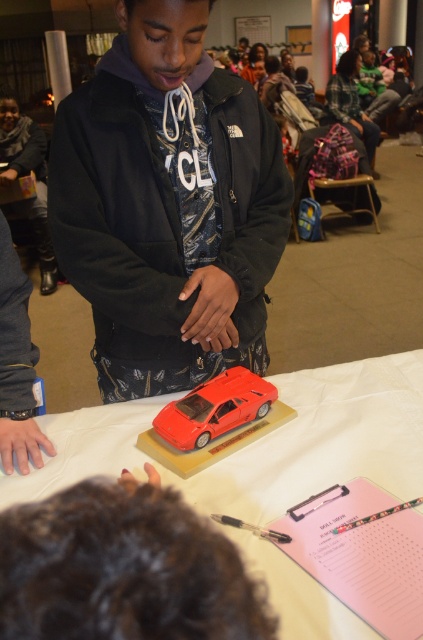
Is glossy plastic car at center smaller than shiny red car at center?

Actually, glossy plastic car at center might be larger than shiny red car at center.

Can you confirm if glossy plastic car at center is thinner than shiny red car at center?

No.

Which is behind, point (371, 428) or point (230, 422)?

The point (371, 428) is behind.

This screenshot has width=423, height=640. I want to click on glossy plastic car at center, so (x=260, y=442).

Which is behind, point (49, 476) or point (353, 64)?

The point (353, 64) is more distant.

Does glossy plastic car at center appear over plaid fabric jacket at upper right?

No.

Describe the element at coordinates (260, 442) in the screenshot. I see `glossy plastic car at center` at that location.

Locate an element on the screen. glossy plastic car at center is located at coordinates (260, 442).

Does shiny red car at center have a lesser height compared to plaid fabric jacket at upper right?

Correct, shiny red car at center is not as tall as plaid fabric jacket at upper right.

In order to click on shiny red car at center in this screenshot , I will do `click(214, 408)`.